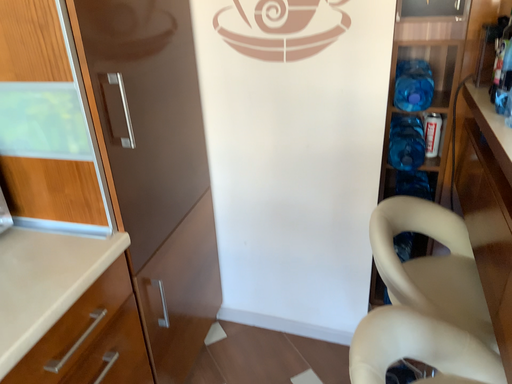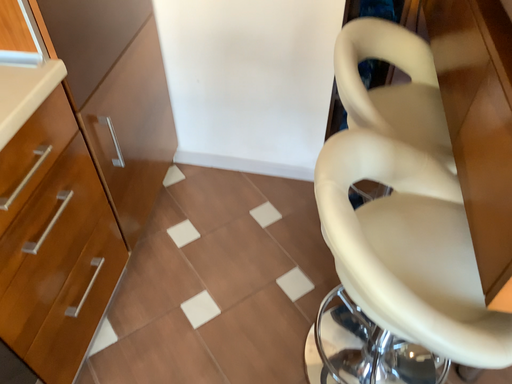
Question: Which way did the camera rotate in the video?

Choices:
 (A) rotated upward
 (B) rotated downward

Answer: (B)